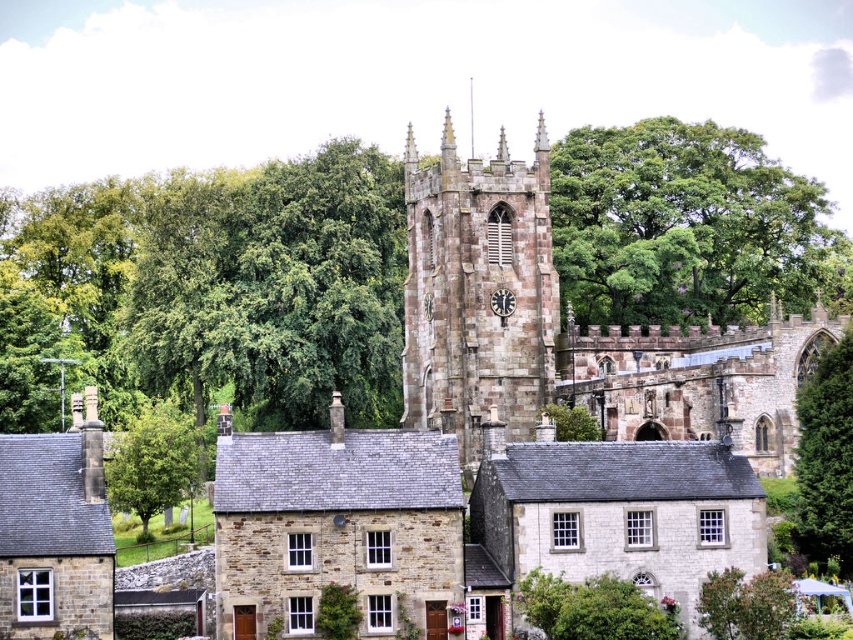
Question: Can you confirm if green leafy tree at center is positioned above metallic clock at center?

Choices:
 (A) no
 (B) yes

Answer: (A)

Question: Which point is closer to the camera taking this photo?

Choices:
 (A) (799, 419)
 (B) (730, 387)
 (C) (503, 308)
 (D) (540, 161)

Answer: (A)

Question: Is rustic stone church at center above stone clock tower at center?

Choices:
 (A) yes
 (B) no

Answer: (B)

Question: Is green leafy tree at upper right positioned before green leafy tree at center?

Choices:
 (A) no
 (B) yes

Answer: (A)

Question: Among these objects, which one is farthest from the camera?

Choices:
 (A) rustic stone church at center
 (B) green leafy tree at lower left

Answer: (B)

Question: Among these points, which one is farthest from the camera?

Choices:
 (A) (509, 308)
 (B) (421, 241)
 (C) (576, 204)
 (D) (187, 432)

Answer: (C)